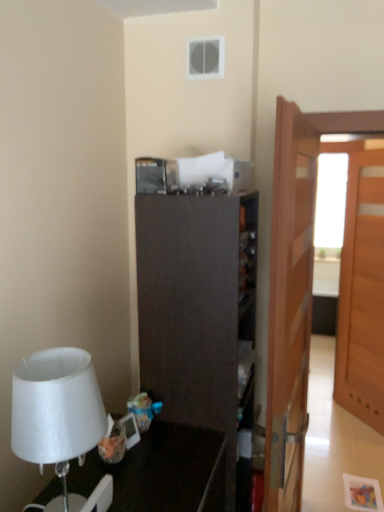
You are a GUI agent. You are given a task and a screenshot of the screen. Output one action in this format:
    pyautogui.click(x=<x>, y=<y>)
    Task: Click on the free space to the left of light brown wooden door at right, the second door positioned from the front
    
    Given the screenshot: What is the action you would take?
    pyautogui.click(x=337, y=423)